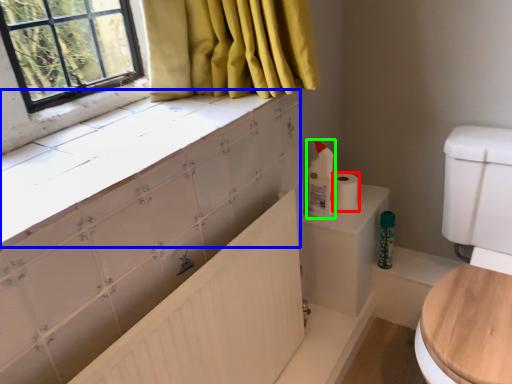
Question: Based on their relative distances, which object is farther from toilet paper (highlighted by a red box)? Choose from counter top (highlighted by a blue box) and cleaning product (highlighted by a green box).

Choices:
 (A) counter top
 (B) cleaning product

Answer: (A)